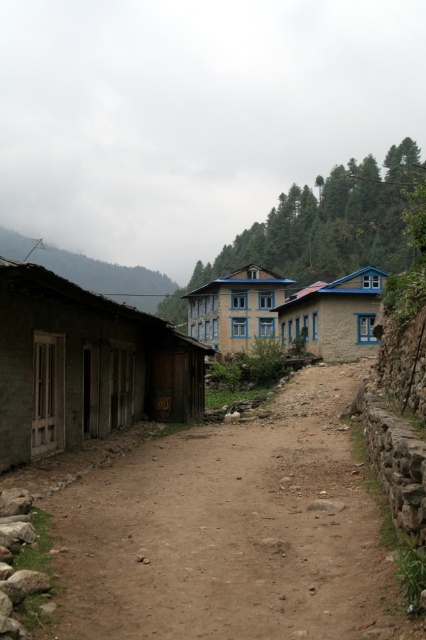
Question: Which is nearer to the dark gray concrete hut at left?

Choices:
 (A) brown dirt track at center
 (B) yellow stone building at center
 (C) blue stucco building at center

Answer: (A)

Question: Which point appears closest to the camera in this image?

Choices:
 (A) (85, 272)
 (B) (365, 332)
 (C) (207, 314)

Answer: (B)

Question: Which point is farther from the camera taking this photo?

Choices:
 (A) tap(259, 326)
 (B) tap(226, 605)
 (C) tap(149, 288)
 (D) tap(43, 304)

Answer: (C)

Question: Is brown dirt track at center further to camera compared to blue stucco building at center?

Choices:
 (A) yes
 (B) no

Answer: (B)

Question: In this image, where is dark gray concrete hut at left located relative to yellow stone building at center?

Choices:
 (A) left
 (B) right

Answer: (A)

Question: Does brown dirt track at center appear on the left side of blue stucco building at center?

Choices:
 (A) no
 (B) yes

Answer: (B)